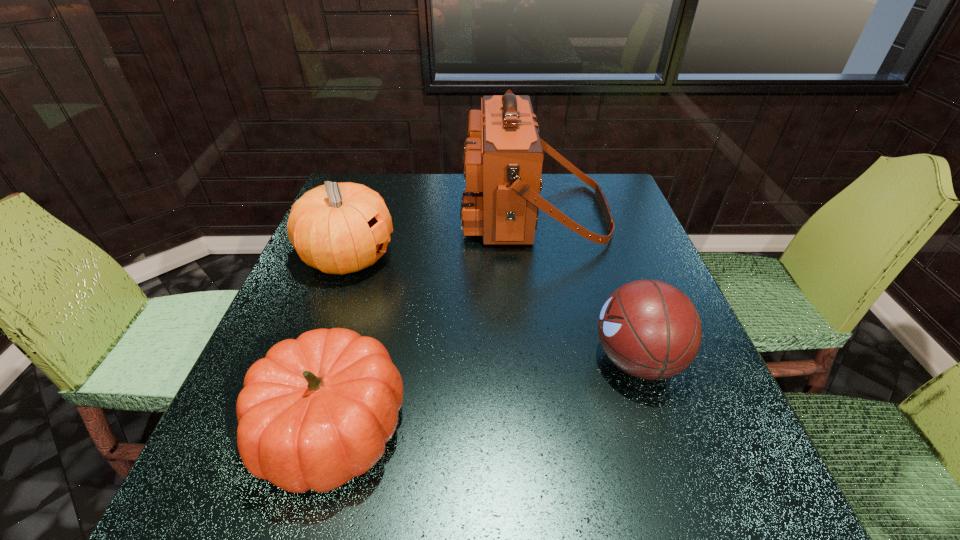
Where is `vacant space located 0.310m on the right of the nearer pumpkin`? vacant space located 0.310m on the right of the nearer pumpkin is located at coordinates (588, 428).

Locate an element on the screen. object that is positioned at the far edge is located at coordinates (502, 159).

Locate an element on the screen. object located in the near edge section of the desktop is located at coordinates (317, 411).

The image size is (960, 540). In order to click on satchel present at the right edge in this screenshot , I will do `click(502, 159)`.

Locate an element on the screen. Image resolution: width=960 pixels, height=540 pixels. basketball present at the right edge is located at coordinates (649, 329).

The image size is (960, 540). In order to click on object that is at the near left corner in this screenshot , I will do `click(317, 411)`.

Locate an element on the screen. The image size is (960, 540). object that is at the far right corner is located at coordinates (502, 159).

Find the location of a particular element. vacant space at the far edge of the desktop is located at coordinates (560, 200).

Image resolution: width=960 pixels, height=540 pixels. I want to click on free point at the near edge, so click(525, 515).

I want to click on vacant space at the right edge of the desktop, so click(669, 406).